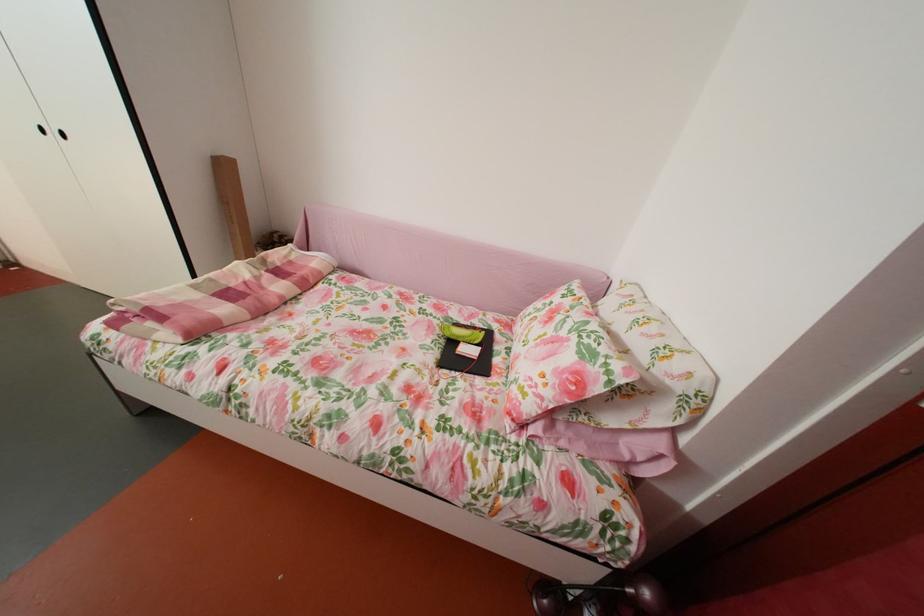
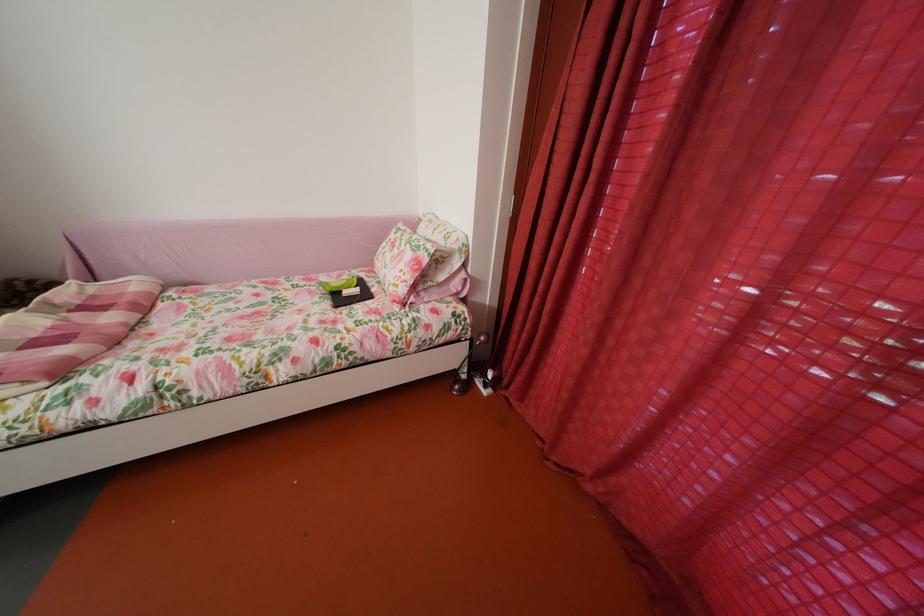
In the second image, find the point that corresponds to [579,363] in the first image.

(419, 262)